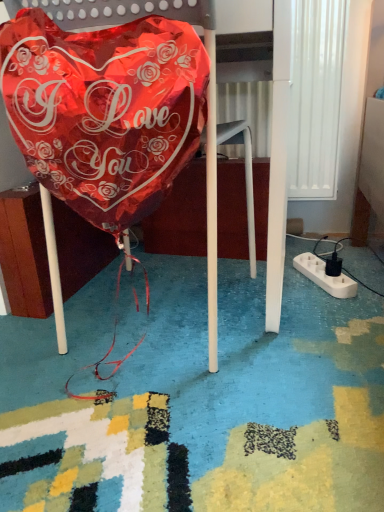
Locate an element on the screen. Image resolution: width=384 pixels, height=512 pixels. free space to the left of white plastic extension cord at lower right is located at coordinates (264, 286).